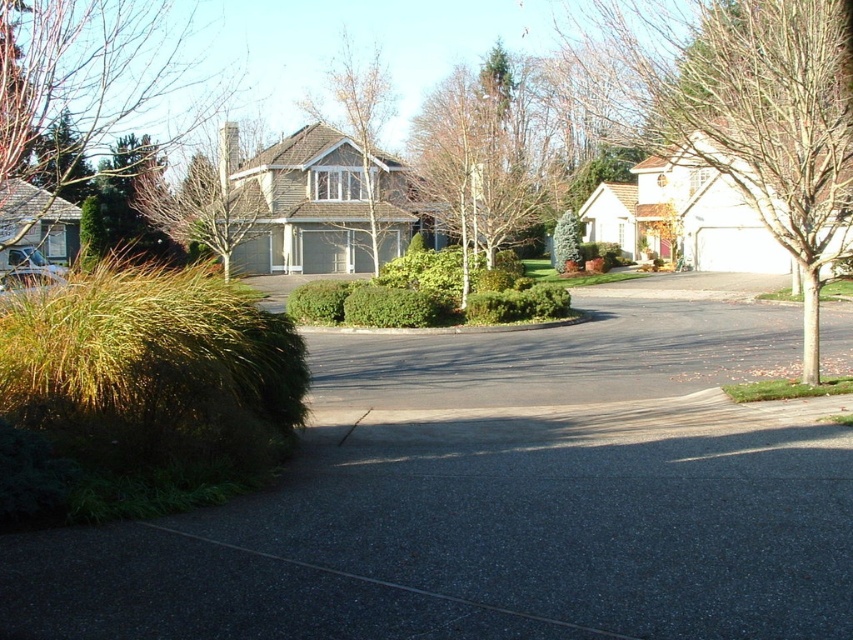
Image resolution: width=853 pixels, height=640 pixels. Describe the element at coordinates (500, 499) in the screenshot. I see `black asphalt driveway at center` at that location.

Does black asphalt driveway at center have a lesser width compared to brown textured tree at center?

In fact, black asphalt driveway at center might be wider than brown textured tree at center.

Is point (466, 588) in front of point (378, 58)?

Yes, point (466, 588) is closer to viewer.

Where is `black asphalt driveway at center`? This screenshot has height=640, width=853. black asphalt driveway at center is located at coordinates (500, 499).

Between green leafy bush at center and green leafy hedge at center, which one is positioned lower?

green leafy hedge at center is lower down.

The image size is (853, 640). What are the coordinates of `green leafy bush at center` in the screenshot? It's located at (396, 307).

Where is `green leafy bush at center`? green leafy bush at center is located at coordinates (396, 307).

Does bare wood tree at right appear on the right side of green leafy hedge at center?

Correct, you'll find bare wood tree at right to the right of green leafy hedge at center.

Can you confirm if bare wood tree at right is bigger than green leafy hedge at center?

Correct, bare wood tree at right is larger in size than green leafy hedge at center.

The image size is (853, 640). What are the coordinates of `bare wood tree at right` in the screenshot? It's located at (734, 109).

I want to click on bare wood tree at right, so click(x=734, y=109).